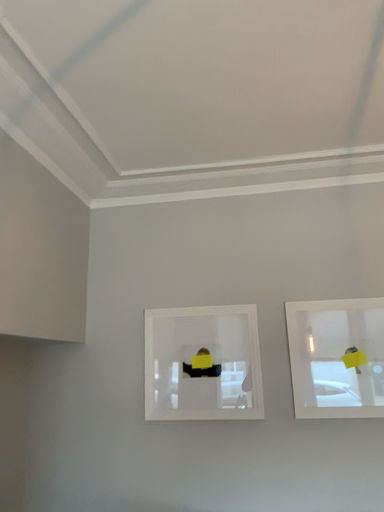
Question: Which direction should I rotate to look at clear plastic picture frame at center, the 2th picture frame positioned from the right, — up or down?

Choices:
 (A) up
 (B) down

Answer: (B)

Question: Is clear glass picture frame at upper right, placed as the 2th picture frame when sorted from left to right, outside clear plastic picture frame at center, the 2th picture frame positioned from the right?

Choices:
 (A) yes
 (B) no

Answer: (A)

Question: Is the position of clear glass picture frame at upper right, the first picture frame from the right, more distant than that of clear plastic picture frame at center, the 2th picture frame positioned from the right?

Choices:
 (A) yes
 (B) no

Answer: (B)

Question: Does clear glass picture frame at upper right, placed as the 2th picture frame when sorted from left to right, have a lesser width compared to clear plastic picture frame at center, marked as the first picture frame in a left-to-right arrangement?

Choices:
 (A) no
 (B) yes

Answer: (A)

Question: Is clear glass picture frame at upper right, placed as the 2th picture frame when sorted from left to right, bigger than clear plastic picture frame at center, the 2th picture frame positioned from the right?

Choices:
 (A) yes
 (B) no

Answer: (B)

Question: Is clear glass picture frame at upper right, the first picture frame from the right, not near clear plastic picture frame at center, marked as the first picture frame in a left-to-right arrangement?

Choices:
 (A) yes
 (B) no

Answer: (B)

Question: From the image's perspective, does clear glass picture frame at upper right, the first picture frame from the right, appear lower than clear plastic picture frame at center, marked as the first picture frame in a left-to-right arrangement?

Choices:
 (A) no
 (B) yes

Answer: (A)

Question: Considering the relative positions of clear plastic picture frame at center, the 2th picture frame positioned from the right, and clear glass picture frame at upper right, placed as the 2th picture frame when sorted from left to right, in the image provided, is clear plastic picture frame at center, the 2th picture frame positioned from the right, to the left of clear glass picture frame at upper right, placed as the 2th picture frame when sorted from left to right, from the viewer's perspective?

Choices:
 (A) no
 (B) yes

Answer: (B)

Question: Considering the relative sizes of clear plastic picture frame at center, marked as the first picture frame in a left-to-right arrangement, and clear glass picture frame at upper right, placed as the 2th picture frame when sorted from left to right, in the image provided, is clear plastic picture frame at center, marked as the first picture frame in a left-to-right arrangement, smaller than clear glass picture frame at upper right, placed as the 2th picture frame when sorted from left to right,?

Choices:
 (A) yes
 (B) no

Answer: (B)

Question: Is clear plastic picture frame at center, marked as the first picture frame in a left-to-right arrangement, turned away from clear glass picture frame at upper right, placed as the 2th picture frame when sorted from left to right?

Choices:
 (A) no
 (B) yes

Answer: (A)

Question: Does clear plastic picture frame at center, the 2th picture frame positioned from the right, have a greater height compared to clear glass picture frame at upper right, the first picture frame from the right?

Choices:
 (A) yes
 (B) no

Answer: (B)

Question: Does clear plastic picture frame at center, the 2th picture frame positioned from the right, have a lesser height compared to clear glass picture frame at upper right, placed as the 2th picture frame when sorted from left to right?

Choices:
 (A) no
 (B) yes

Answer: (B)

Question: From the image's perspective, is clear plastic picture frame at center, marked as the first picture frame in a left-to-right arrangement, beneath clear glass picture frame at upper right, the first picture frame from the right?

Choices:
 (A) yes
 (B) no

Answer: (A)

Question: Based on their sizes in the image, would you say clear plastic picture frame at center, marked as the first picture frame in a left-to-right arrangement, is bigger or smaller than clear glass picture frame at upper right, the first picture frame from the right?

Choices:
 (A) big
 (B) small

Answer: (A)